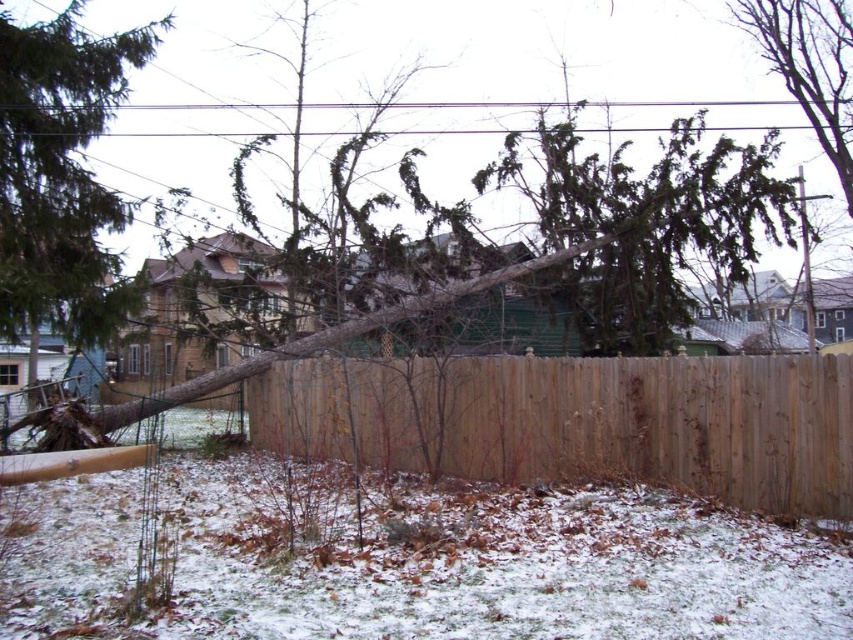
Question: Does brown wood fence at center appear under bare wood tree at upper right?

Choices:
 (A) yes
 (B) no

Answer: (A)

Question: Does green needle-like tree at left appear over bare wood tree at upper right?

Choices:
 (A) no
 (B) yes

Answer: (A)

Question: Which object appears closest to the camera in this image?

Choices:
 (A) green needle-like tree at left
 (B) bare wood tree at upper right
 (C) brown wood fence at center

Answer: (C)

Question: Which of the following is the closest to the observer?

Choices:
 (A) (262, 413)
 (B) (74, 70)

Answer: (B)

Question: Which point is farther to the camera?

Choices:
 (A) brown wood fence at center
 (B) bare wood tree at upper right
 (C) green needle-like tree at left

Answer: (B)

Question: Observing the image, what is the correct spatial positioning of brown wood fence at center in reference to bare wood tree at upper right?

Choices:
 (A) right
 (B) left

Answer: (B)